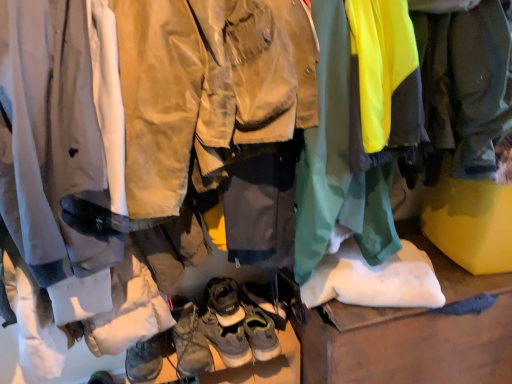
Question: From a real-world perspective, is leather/textured boot at center, acting as the 5th footwear starting from the bottom, physically located above or below leather/textured boots at center, which appears as the third footwear when ordered from the bottom?

Choices:
 (A) below
 (B) above

Answer: (B)

Question: From the image's perspective, is leather/textured boot at center, which appears as the first footwear when viewed from the top, positioned above or below leather/textured boots at center, acting as the 3th footwear starting from the top?

Choices:
 (A) above
 (B) below

Answer: (A)

Question: Which object is positioned closest to the leather/textured boot at center, acting as the 5th footwear starting from the bottom?

Choices:
 (A) leather/textured boots at center, acting as the 3th footwear starting from the top
 (B) leather suede hiking boots at center, which ranks as the fourth footwear in bottom-to-top order
 (C) brown leather boots at center, marked as the 1th footwear in a bottom-to-top arrangement
 (D) leather brown hiking boots at center, the 2th footwear from the bottom

Answer: (A)

Question: Which of these objects is positioned farthest from the leather brown hiking boots at center, which is the fourth footwear in top-to-bottom order?

Choices:
 (A) brown leather boots at center, marked as the 1th footwear in a bottom-to-top arrangement
 (B) leather/textured boots at center, acting as the 3th footwear starting from the top
 (C) leather/textured boot at center, which appears as the first footwear when viewed from the top
 (D) leather suede hiking boots at center, the 2th footwear from the top

Answer: (D)